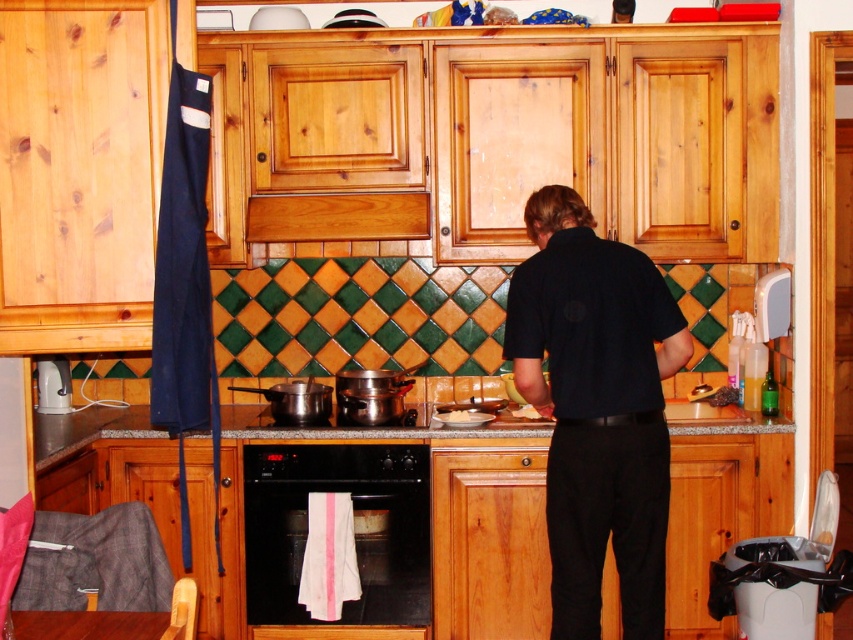
Question: Which of these objects is positioned closest to the white creamy food at center?

Choices:
 (A) granite gray counter top at center
 (B) black matte oven at center
 (C) black matte shirt at center
 (D) black metallic stove at center

Answer: (D)

Question: Where is black matte shirt at center located in relation to black metallic stove at center in the image?

Choices:
 (A) left
 (B) right

Answer: (B)

Question: Which point is farther to the camera?

Choices:
 (A) (41, 394)
 (B) (270, 529)

Answer: (A)

Question: Does black matte oven at center appear over granite gray counter top at center?

Choices:
 (A) no
 (B) yes

Answer: (A)

Question: Which point is farther to the camera?

Choices:
 (A) black matte shirt at center
 (B) black matte oven at center
 (C) white creamy food at center

Answer: (C)

Question: Does black matte shirt at center have a smaller size compared to black metallic stove at center?

Choices:
 (A) yes
 (B) no

Answer: (B)